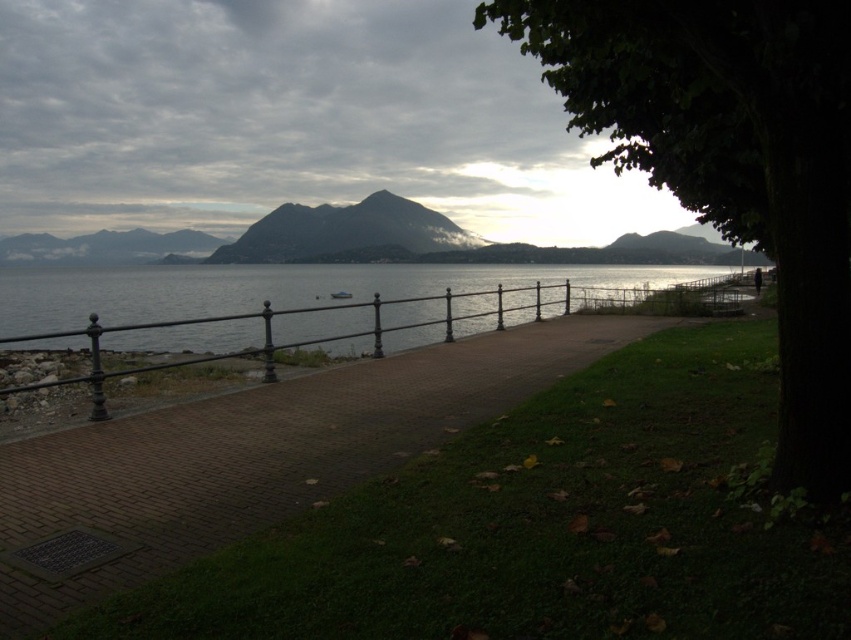
Is clear water at center positioned behind gray rocky mountain at center?

No, clear water at center is in front of gray rocky mountain at center.

Measure the distance between point [604,282] and camera.

They are 49.72 meters apart.

I want to click on clear water at center, so [298, 291].

Between brick paved path at center and clear water at center, which one is positioned higher?

clear water at center is higher up.

From the picture: Can you confirm if brick paved path at center is bigger than clear water at center?

Incorrect, brick paved path at center is not larger than clear water at center.

Does point (350, 380) come farther from viewer compared to point (50, 307)?

No, it is not.

This screenshot has width=851, height=640. In order to click on brick paved path at center in this screenshot , I will do `click(260, 452)`.

Is point (567, 104) farther from viewer compared to point (133, 294)?

No, (567, 104) is closer to viewer.

Between point (751, 81) and point (395, 273), which one is positioned behind?

Positioned behind is point (395, 273).

This screenshot has height=640, width=851. I want to click on green leafy tree at right, so click(x=732, y=160).